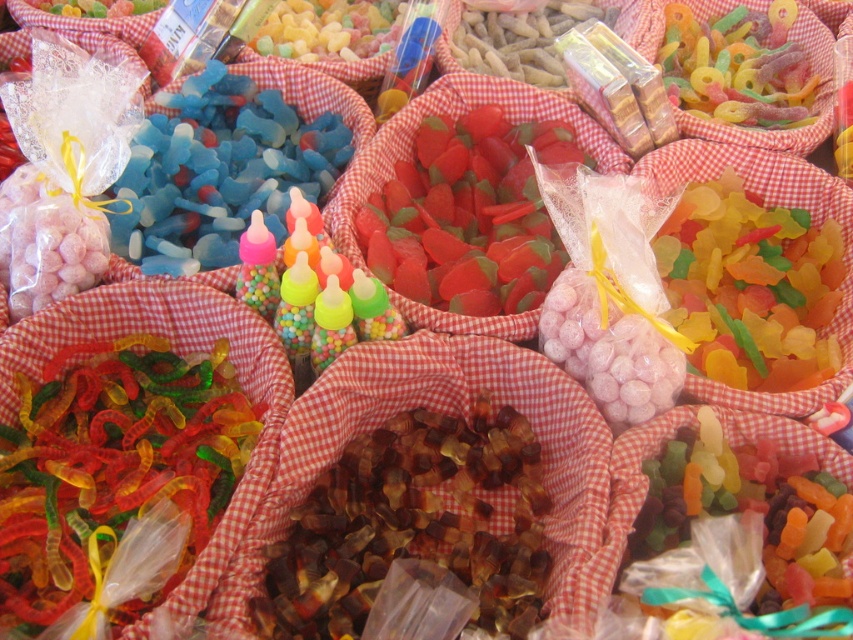
You are a customer at a candy store and see the translucent amber gummy bears at center and the blue translucent gummy bears at upper left. Which of these candies is positioned to the left side of the other?

The blue translucent gummy bears at upper left are positioned to the left of the translucent amber gummy bears at center.

You are a candy store employee who wants to stack candies on a shelf. You have the translucent amber gummy bears at center and the blue translucent gummy bears at upper left. Which candy should you choose to place on the bottom of the stack to ensure stability?

You should choose the blue translucent gummy bears at upper left to place on the bottom of the stack because they are taller than the translucent amber gummy bears at center, providing a more stable base.